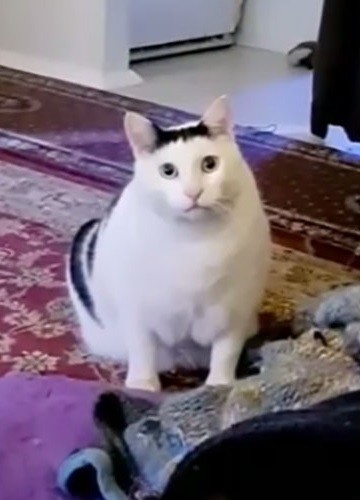
The height and width of the screenshot is (500, 360). What are the coordinates of `purple pillow` in the screenshot? It's located at (41, 417).